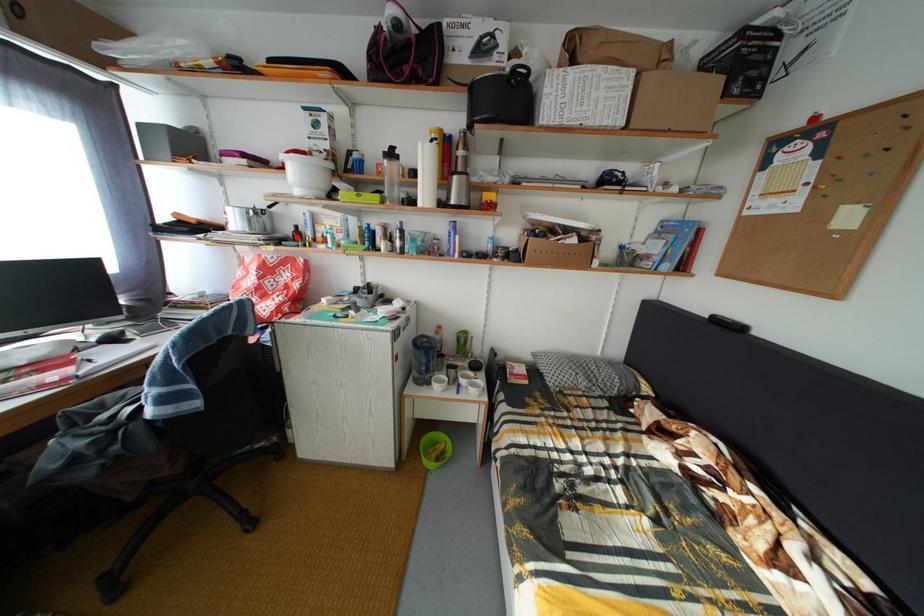
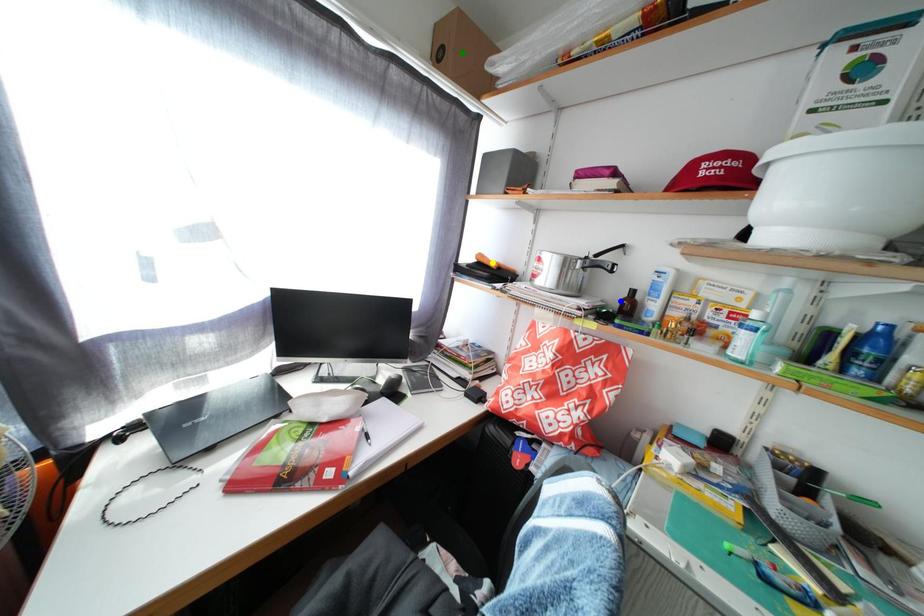
Question: I am providing you with two images of the same scene from different viewpoints. A red point is marked on the first image. You are given multiple points on the second image. In image 2, which mark is for the same physical point as the one in image 1?

Choices:
 (A) green point
 (B) yellow point
 (C) blue point

Answer: (C)